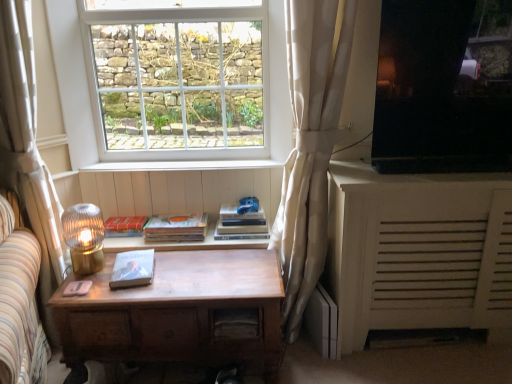
Question: Which direction should I rotate to face matte red paperback book at center, which is the 3th paperback book in front-to-back order, — up or down?

Choices:
 (A) down
 (B) up

Answer: (A)

Question: Does white textured cabinet at right contain matte red paperback book at center, which is counted as the 1th paperback book, starting from the back?

Choices:
 (A) yes
 (B) no

Answer: (B)

Question: Is the position of white textured cabinet at right more distant than that of matte red paperback book at center, which is the 3th paperback book in front-to-back order?

Choices:
 (A) yes
 (B) no

Answer: (B)

Question: Can you confirm if white textured cabinet at right is bigger than matte red paperback book at center, which is the 3th paperback book in front-to-back order?

Choices:
 (A) no
 (B) yes

Answer: (B)

Question: Is white textured cabinet at right with matte red paperback book at center, which is counted as the 1th paperback book, starting from the back?

Choices:
 (A) yes
 (B) no

Answer: (B)

Question: Is the depth of white textured cabinet at right less than that of matte red paperback book at center, which is counted as the 1th paperback book, starting from the back?

Choices:
 (A) yes
 (B) no

Answer: (A)

Question: Considering the relative positions of white textured cabinet at right and matte red paperback book at center, which is counted as the 1th paperback book, starting from the back, in the image provided, is white textured cabinet at right to the left of matte red paperback book at center, which is counted as the 1th paperback book, starting from the back, from the viewer's perspective?

Choices:
 (A) yes
 (B) no

Answer: (B)

Question: Is white textured cabinet at right located outside hardcover book at center, which appears as the second paperback book when viewed from the back?

Choices:
 (A) yes
 (B) no

Answer: (A)

Question: Is the depth of white textured cabinet at right less than that of hardcover book at center, which appears as the second paperback book when viewed from the front?

Choices:
 (A) yes
 (B) no

Answer: (A)

Question: Can you confirm if white textured cabinet at right is smaller than hardcover book at center, which appears as the second paperback book when viewed from the front?

Choices:
 (A) yes
 (B) no

Answer: (B)

Question: Can you confirm if white textured cabinet at right is shorter than hardcover book at center, which appears as the second paperback book when viewed from the front?

Choices:
 (A) no
 (B) yes

Answer: (A)

Question: From a real-world perspective, is white textured cabinet at right over hardcover book at center, which appears as the second paperback book when viewed from the back?

Choices:
 (A) yes
 (B) no

Answer: (B)

Question: Considering the relative positions of white textured cabinet at right and hardcover book at center, which appears as the second paperback book when viewed from the back, in the image provided, is white textured cabinet at right to the left of hardcover book at center, which appears as the second paperback book when viewed from the back, from the viewer's perspective?

Choices:
 (A) no
 (B) yes

Answer: (A)

Question: Does white textured curtain at center, placed as the second curtain when sorted from left to right, have a smaller size compared to hardcover book at center?

Choices:
 (A) yes
 (B) no

Answer: (B)